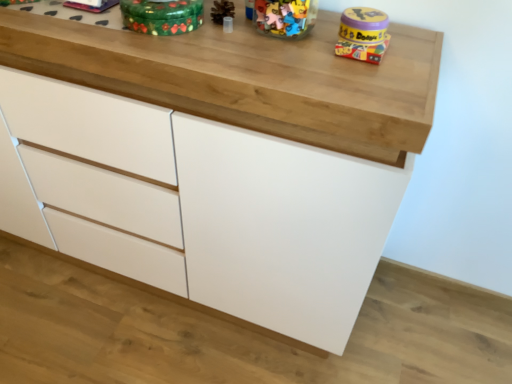
Where is `free space in front of matte yellow plastic toy at upper right, the first toy when ordered from right to left`? The image size is (512, 384). free space in front of matte yellow plastic toy at upper right, the first toy when ordered from right to left is located at coordinates point(364,75).